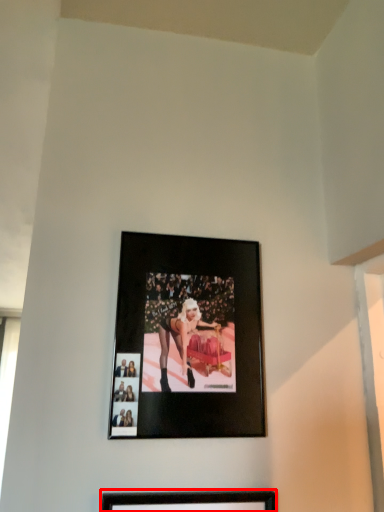
Question: From the image's perspective, where is picture frame (annotated by the red box) located in relation to picture frame in the image?

Choices:
 (A) above
 (B) below

Answer: (B)